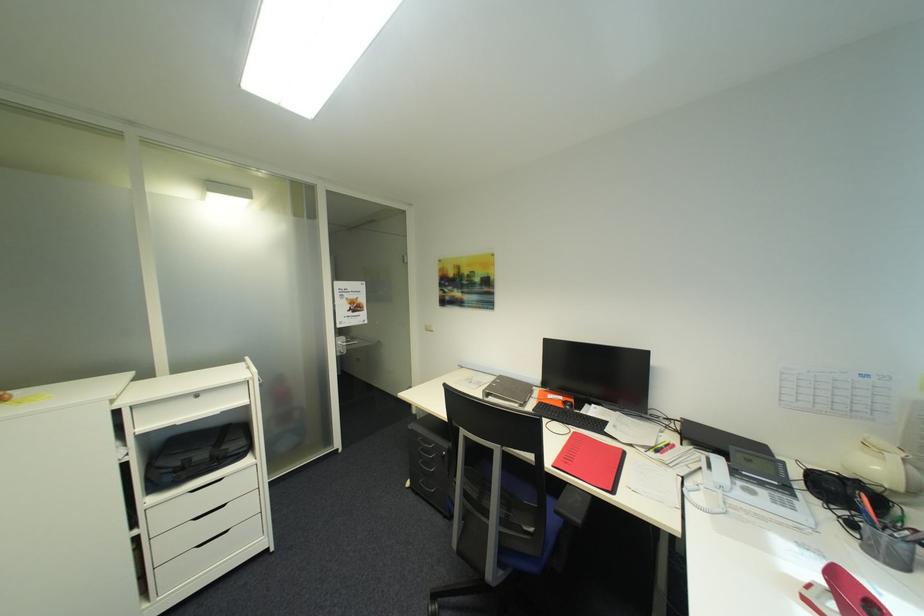
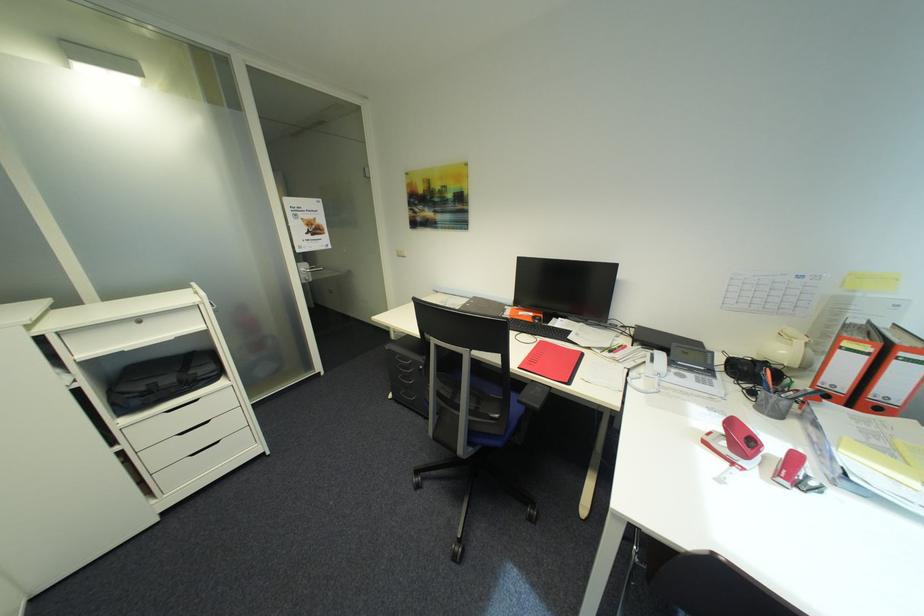
Find the pixel in the second image that matches (x=859, y=525) in the first image.

(760, 392)